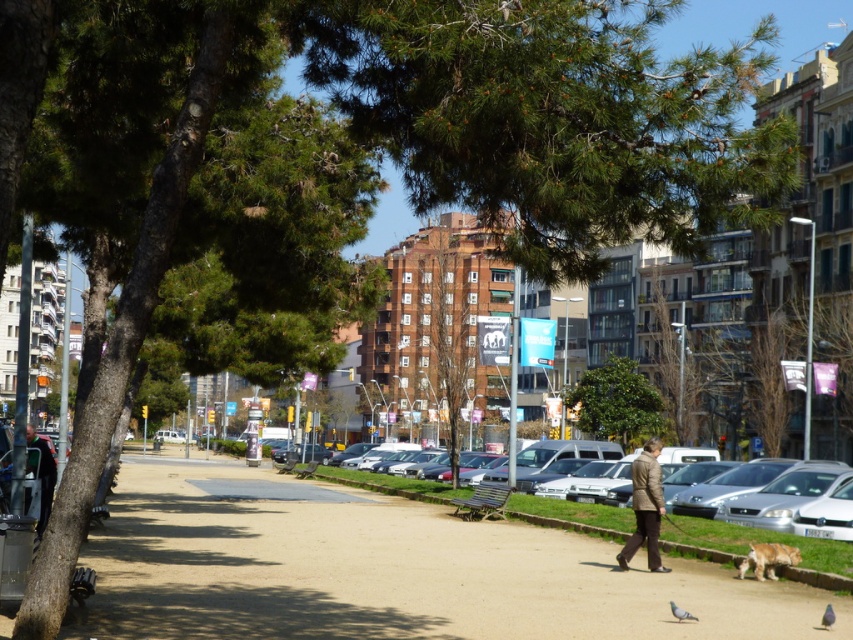
Consider the image. You are a delivery drone that needs to fly from the silver metallic sedan at center to the gray matte pigeon at lower center. Considering their heights, will you have to adjust your flight path to avoid collision?

The silver metallic sedan at center is much taller than the gray matte pigeon at lower center, so the drone should adjust its flight path to stay above the sedan to avoid collision.

You are standing at the point closer to the camera in the image. Which point are you at, point (633, 369) or point (769, 572)?

You are at point (633, 369) because it is closer to the camera than point (769, 572).

You are a pedestrian standing on the pathway shaded by the large pine tree on the left. You want to cross to the grassy area where the parked cars are. Is the silver metallic sedan at center closer to you than the gray matte pigeon at lower center?

The silver metallic sedan at center is below the gray matte pigeon at lower center, so the sedan is closer to you than the pigeon.